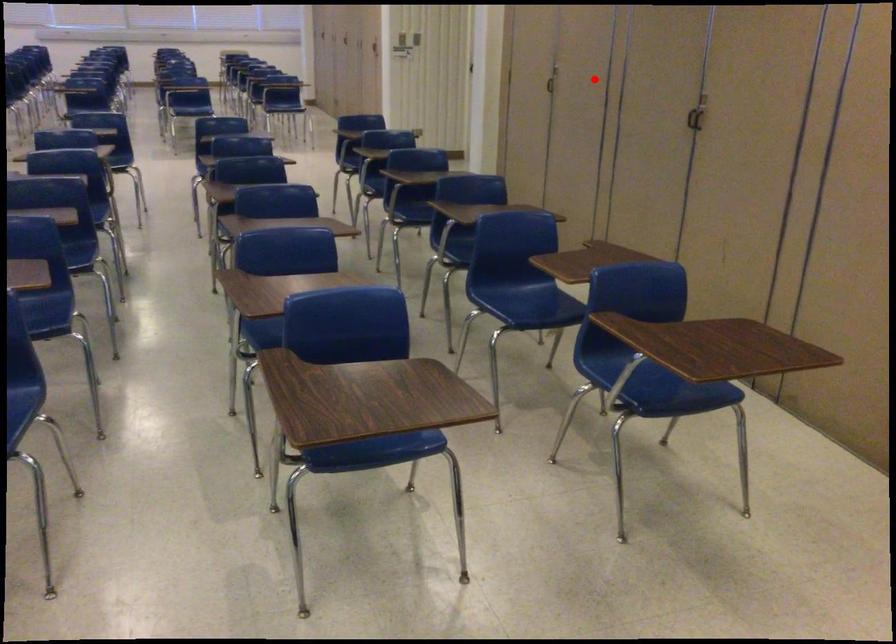
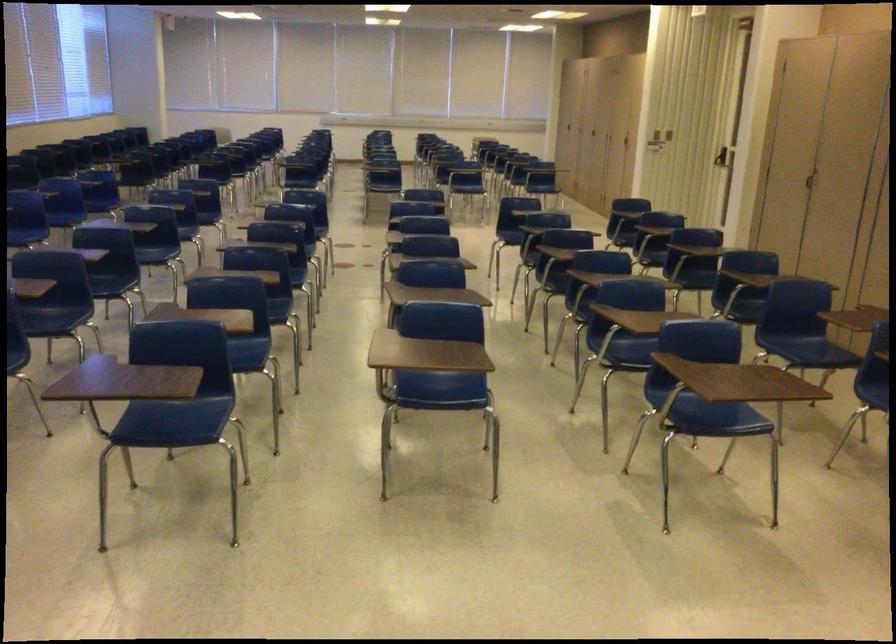
The point at the highlighted location is marked in the first image. Where is the corresponding point in the second image?

(853, 173)